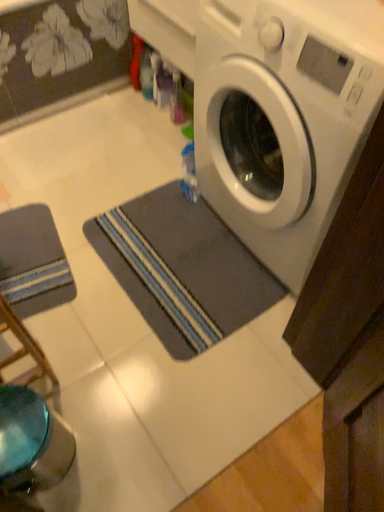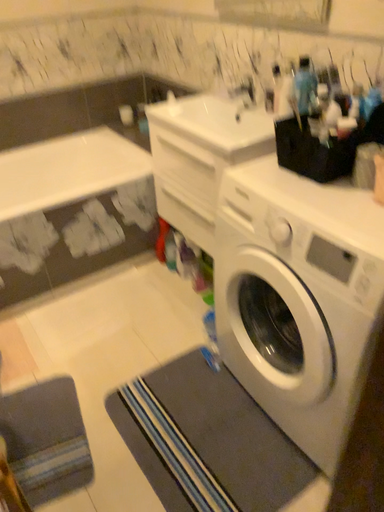
Question: Which way did the camera rotate in the video?

Choices:
 (A) rotated upward
 (B) rotated downward

Answer: (A)